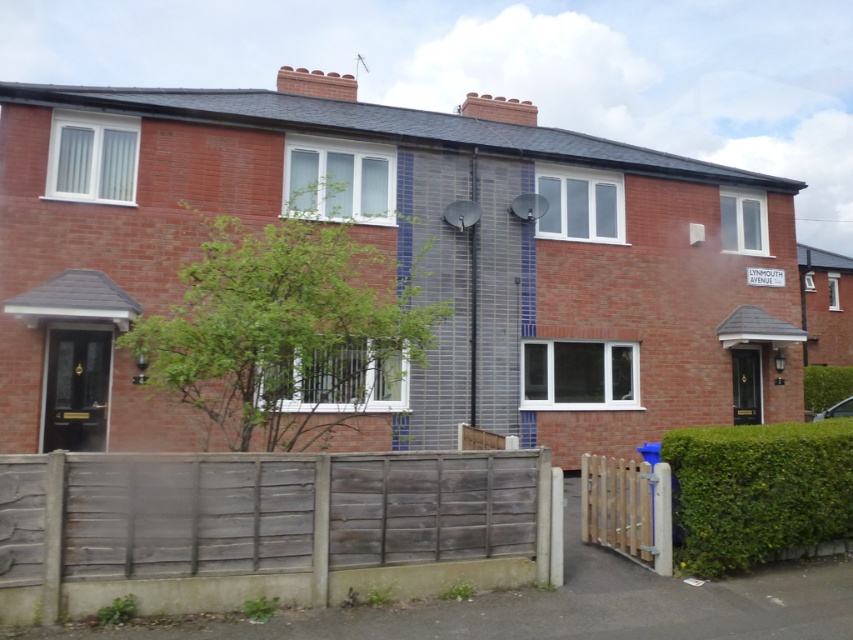
You are a delivery person approaching the house and see the green leafy hedge at lower right and the wooden picket gate at lower right. Which object should you go through to enter the property?

The wooden picket gate at lower right is the entrance, so you should go through the wooden picket gate at lower right to enter the property.

You are a delivery person approaching the wooden picket gate at lower right. You notice a green leafy hedge at lower right nearby. Which object is taller?

The green leafy hedge at lower right is taller than the wooden picket gate at lower right.